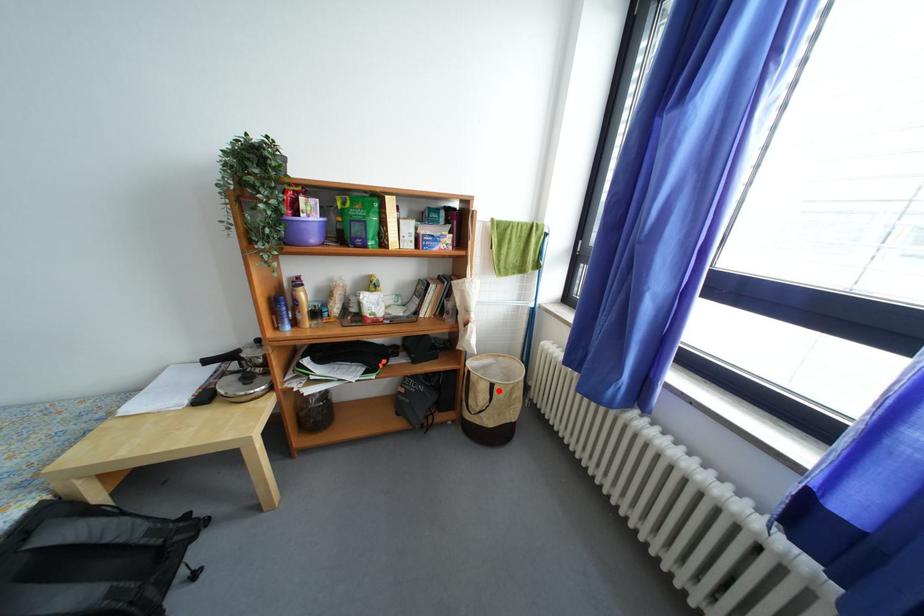
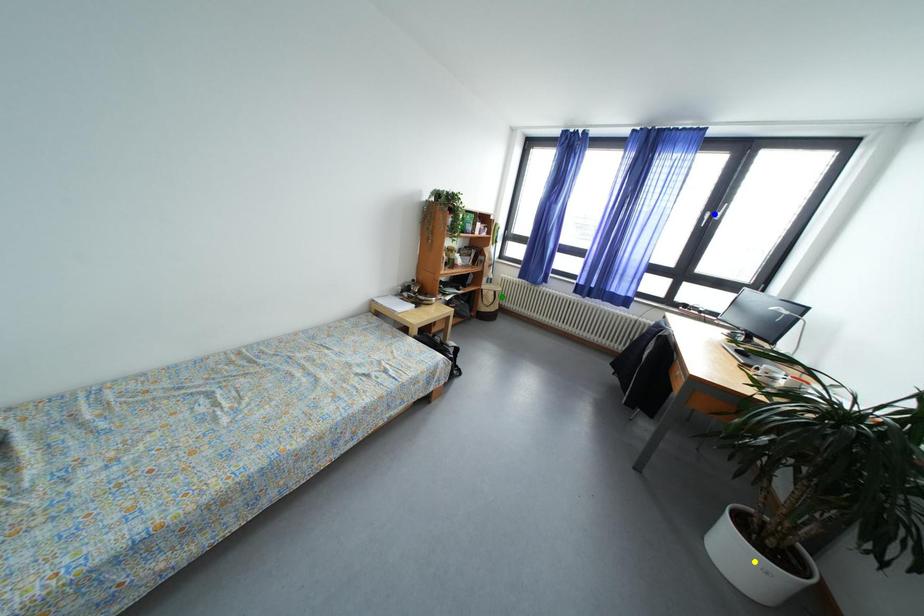
Question: I am providing you with two images of the same scene from different viewpoints. A red point is marked on the first image. You are given multiple points on the second image. Can you choose the point in image 2 that corresponds to the point in image 1?

Choices:
 (A) blue point
 (B) green point
 (C) yellow point

Answer: (B)